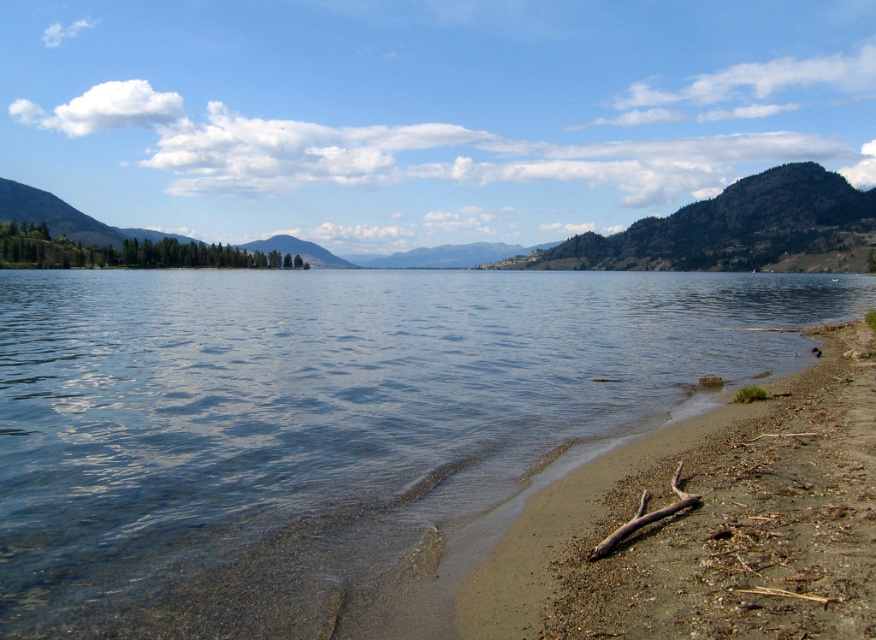
You are standing on the brown sandy beach at lower right and want to reach the clear water at shore left. Based on the scene description, which direction should you move to get to the water?

The clear water at shore left is much taller than the brown sandy beach at lower right, so you should move towards the shore left direction to reach the water.

You are standing on the brown sandy beach at lower right and want to reach the clear water at shore left. Which direction should you walk to get there?

You should walk to the left because the clear water at shore left is positioned on the right side of brown sandy beach at lower right, meaning it is located to the left of your current position.

You are standing at the brown sandy beach at lower right and want to reach the clear water at shore left. Which direction should you move to get there?

You should move upward to reach the clear water at shore left because it is located above the brown sandy beach at lower right.